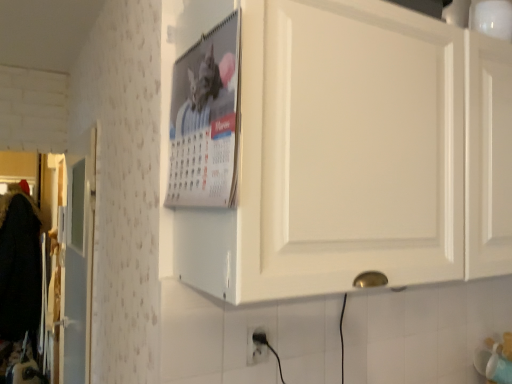
Measure the distance between metallic silver calendar at upper center and camera.

They are 26.97 inches apart.

What are the coordinates of `white plastic electric outlet at lower center` in the screenshot? It's located at (257, 345).

Is the surface of white plastic electric outlet at lower center in direct contact with white matte cabinet at upper center?

white plastic electric outlet at lower center is not next to white matte cabinet at upper center, and they're not touching.

From a real-world perspective, is white plastic electric outlet at lower center above or below white matte cabinet at upper center?

white plastic electric outlet at lower center is below white matte cabinet at upper center.

What's the angular difference between white plastic electric outlet at lower center and white matte cabinet at upper center's facing directions?

They differ by 1.27 degrees in their facing directions.

Locate an element on the screen. This screenshot has width=512, height=384. cabinetry that appears below the metallic silver calendar at upper center (from the image's perspective) is located at coordinates (359, 155).

Considering the relative sizes of white matte cabinet at upper center and metallic silver calendar at upper center in the image provided, is white matte cabinet at upper center shorter than metallic silver calendar at upper center?

Incorrect, the height of white matte cabinet at upper center does not fall short of that of metallic silver calendar at upper center.

Would you say white matte cabinet at upper center is inside or outside metallic silver calendar at upper center?

white matte cabinet at upper center is outside metallic silver calendar at upper center.

In the scene shown: Is white matte cabinet at upper center bigger or smaller than metallic silver calendar at upper center?

In the image, white matte cabinet at upper center appears to be larger than metallic silver calendar at upper center.

You are a GUI agent. You are given a task and a screenshot of the screen. Output one action in this format:
    pyautogui.click(x=<x>, y=<y>)
    Task: Click on the electric outlet below the white matte cabinet at upper center (from the image's perspective)
    
    Given the screenshot: What is the action you would take?
    tap(257, 345)

Which point is more forward, (374, 231) or (259, 338)?

Positioned in front is point (374, 231).

Is white matte cabinet at upper center to the right of white plastic electric outlet at lower center from the viewer's perspective?

Yes.

From a real-world perspective, which is physically below, white matte cabinet at upper center or white plastic electric outlet at lower center?

In real-world perspective, white plastic electric outlet at lower center is lower.

Which is more distant, [199,148] or [201,20]?

The point [201,20] is farther from the camera.

Is metallic silver calendar at upper center oriented away from white matte cabinet at upper center?

Yes.

In the scene shown: In the image, is metallic silver calendar at upper center positioned in front of or behind white matte cabinet at upper center?

metallic silver calendar at upper center is behind white matte cabinet at upper center.

Visually, is metallic silver calendar at upper center positioned to the left or to the right of white matte cabinet at upper center?

Clearly, metallic silver calendar at upper center is on the left of white matte cabinet at upper center in the image.

Would you say metallic silver calendar at upper center is inside or outside white plastic electric outlet at lower center?

metallic silver calendar at upper center is outside white plastic electric outlet at lower center.

From a real-world perspective, is metallic silver calendar at upper center below white plastic electric outlet at lower center?

No.

From the image's perspective, which is above, metallic silver calendar at upper center or white plastic electric outlet at lower center?

metallic silver calendar at upper center, from the image's perspective.

Identify the location of electric outlet below the metallic silver calendar at upper center (from a real-world perspective). (257, 345).

Is white plastic electric outlet at lower center spatially inside metallic silver calendar at upper center, or outside of it?

white plastic electric outlet at lower center exists outside the volume of metallic silver calendar at upper center.

From the image's perspective, is white plastic electric outlet at lower center on top of metallic silver calendar at upper center?

No, from the image's perspective, white plastic electric outlet at lower center is not above metallic silver calendar at upper center.

How different are the orientations of white plastic electric outlet at lower center and metallic silver calendar at upper center in degrees?

The angle between the facing direction of white plastic electric outlet at lower center and the facing direction of metallic silver calendar at upper center is 87.6 degrees.

Identify the location of electric outlet lying below the metallic silver calendar at upper center (from the image's perspective). (257, 345).

Image resolution: width=512 pixels, height=384 pixels. I want to click on electric outlet on the left of the white matte cabinet at upper center, so click(x=257, y=345).

This screenshot has width=512, height=384. Find the location of `cabinetry on the right side of metallic silver calendar at upper center`. cabinetry on the right side of metallic silver calendar at upper center is located at coordinates (359, 155).

Estimate the real-world distances between objects in this image. Which object is closer to white matte cabinet at upper center, white plastic electric outlet at lower center or metallic silver calendar at upper center?

metallic silver calendar at upper center lies closer to white matte cabinet at upper center than the other object.

Considering their positions, is metallic silver calendar at upper center positioned further to white plastic electric outlet at lower center than white matte cabinet at upper center?

The object further to white plastic electric outlet at lower center is white matte cabinet at upper center.

When comparing their distances from white matte cabinet at upper center, does metallic silver calendar at upper center or white plastic electric outlet at lower center seem further?

Based on the image, white plastic electric outlet at lower center appears to be further to white matte cabinet at upper center.

Looking at the image, which one is located further to white plastic electric outlet at lower center, white matte cabinet at upper center or metallic silver calendar at upper center?

Among the two, white matte cabinet at upper center is located further to white plastic electric outlet at lower center.

Considering their positions, is white matte cabinet at upper center positioned further to metallic silver calendar at upper center than white plastic electric outlet at lower center?

The object further to metallic silver calendar at upper center is white plastic electric outlet at lower center.

Considering their positions, is white plastic electric outlet at lower center positioned closer to metallic silver calendar at upper center than white matte cabinet at upper center?

white matte cabinet at upper center is positioned closer to the anchor metallic silver calendar at upper center.

The image size is (512, 384). Find the location of `cabinetry that lies between metallic silver calendar at upper center and white plastic electric outlet at lower center from top to bottom`. cabinetry that lies between metallic silver calendar at upper center and white plastic electric outlet at lower center from top to bottom is located at coordinates (359, 155).